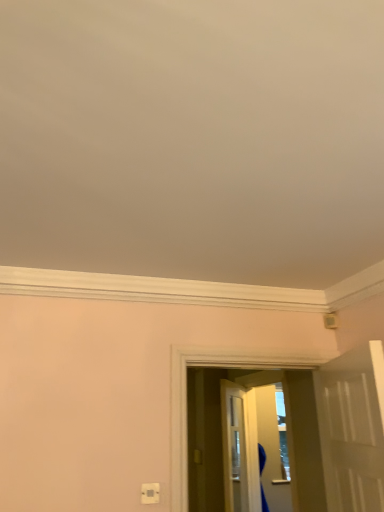
The height and width of the screenshot is (512, 384). What do you see at coordinates (150, 493) in the screenshot?
I see `white plastic electric outlet at lower center` at bounding box center [150, 493].

The width and height of the screenshot is (384, 512). Describe the element at coordinates (352, 428) in the screenshot. I see `white glossy door at right` at that location.

Locate an element on the screen. The image size is (384, 512). transparent plastic screen door at center is located at coordinates (x=274, y=447).

Locate an element on the screen. This screenshot has height=512, width=384. white plastic electric outlet at lower center is located at coordinates (150, 493).

Could transparent plastic screen door at center be considered to be inside white glossy door at right?

That's incorrect, transparent plastic screen door at center is not inside white glossy door at right.

Considering the sizes of white glossy door at right and transparent plastic screen door at center in the image, is white glossy door at right bigger or smaller than transparent plastic screen door at center?

In the image, white glossy door at right appears to be larger than transparent plastic screen door at center.

Considering the positions of objects white glossy door at right and transparent plastic screen door at center in the image provided, who is in front, white glossy door at right or transparent plastic screen door at center?

Positioned in front is white glossy door at right.

How many degrees apart are the facing directions of white glossy door at right and white plastic electric outlet at lower center?

The angle between the facing direction of white glossy door at right and the facing direction of white plastic electric outlet at lower center is 108 degrees.

Is point (347, 417) behind point (158, 486)?

No, (347, 417) is in front of (158, 486).

Which is more to the left, white glossy door at right or white plastic electric outlet at lower center?

white plastic electric outlet at lower center.

Is white plastic electric outlet at lower center next to white glossy door at right and touching it?

No, white plastic electric outlet at lower center is not with white glossy door at right.

Which is closer, [149,488] or [345,372]?

Point [149,488] is positioned farther from the camera compared to point [345,372].

Does white plastic electric outlet at lower center have a greater height compared to white glossy door at right?

No, white plastic electric outlet at lower center is not taller than white glossy door at right.

Is white plastic electric outlet at lower center positioned with its back to white glossy door at right?

No, white glossy door at right is not at the back of white plastic electric outlet at lower center.

Could you tell me if white plastic electric outlet at lower center is facing transparent plastic screen door at center?

No, white plastic electric outlet at lower center is not turned towards transparent plastic screen door at center.

Is white plastic electric outlet at lower center shorter than transparent plastic screen door at center?

Yes, white plastic electric outlet at lower center is shorter than transparent plastic screen door at center.

From the image's perspective, is white plastic electric outlet at lower center above transparent plastic screen door at center?

Yes, from the image's perspective, white plastic electric outlet at lower center is over transparent plastic screen door at center.

Consider the image. How many degrees apart are the facing directions of white plastic electric outlet at lower center and transparent plastic screen door at center?

The angular difference between white plastic electric outlet at lower center and transparent plastic screen door at center is 92.9 degrees.

From the image's perspective, relative to white glossy door at right, is transparent plastic screen door at center above or below?

transparent plastic screen door at center is situated lower than white glossy door at right in the image.

Considering the relative sizes of transparent plastic screen door at center and white glossy door at right in the image provided, is transparent plastic screen door at center bigger than white glossy door at right?

No.

Is transparent plastic screen door at center facing away from white glossy door at right?

No, transparent plastic screen door at center's orientation is not away from white glossy door at right.

Does transparent plastic screen door at center touch white glossy door at right?

No, transparent plastic screen door at center is not next to white glossy door at right.

Looking at this image, from a real-world perspective, is transparent plastic screen door at center positioned above or below white plastic electric outlet at lower center?

transparent plastic screen door at center is above white plastic electric outlet at lower center.

Is white plastic electric outlet at lower center inside transparent plastic screen door at center?

No, white plastic electric outlet at lower center is not a part of transparent plastic screen door at center.

Is transparent plastic screen door at center looking in the opposite direction of white plastic electric outlet at lower center?

No.

From the image's perspective, between transparent plastic screen door at center and white plastic electric outlet at lower center, which one is located above?

white plastic electric outlet at lower center.

The width and height of the screenshot is (384, 512). I want to click on screen door behind the white glossy door at right, so click(x=274, y=447).

Locate an element on the screen. electric outlet on the left of white glossy door at right is located at coordinates (150, 493).

Estimate the real-world distances between objects in this image. Which object is further from white glossy door at right, transparent plastic screen door at center or white plastic electric outlet at lower center?

transparent plastic screen door at center.

Looking at the image, which one is located closer to white plastic electric outlet at lower center, transparent plastic screen door at center or white glossy door at right?

Based on the image, white glossy door at right appears to be nearer to white plastic electric outlet at lower center.

From the image, which object appears to be nearer to transparent plastic screen door at center, white plastic electric outlet at lower center or white glossy door at right?

The object closer to transparent plastic screen door at center is white glossy door at right.

From the image, which object appears to be nearer to transparent plastic screen door at center, white glossy door at right or white plastic electric outlet at lower center?

Among the two, white glossy door at right is located nearer to transparent plastic screen door at center.

When comparing their distances from white plastic electric outlet at lower center, does white glossy door at right or transparent plastic screen door at center seem further?

Based on the image, transparent plastic screen door at center appears to be further to white plastic electric outlet at lower center.

Based on their spatial positions, is white plastic electric outlet at lower center or transparent plastic screen door at center further from white glossy door at right?

The object further to white glossy door at right is transparent plastic screen door at center.

At what (x,y) coordinates should I click in order to perform the action: click on electric outlet between white glossy door at right and transparent plastic screen door at center from front to back. Please return your answer as a coordinate pair (x, y). The height and width of the screenshot is (512, 384). Looking at the image, I should click on (150, 493).